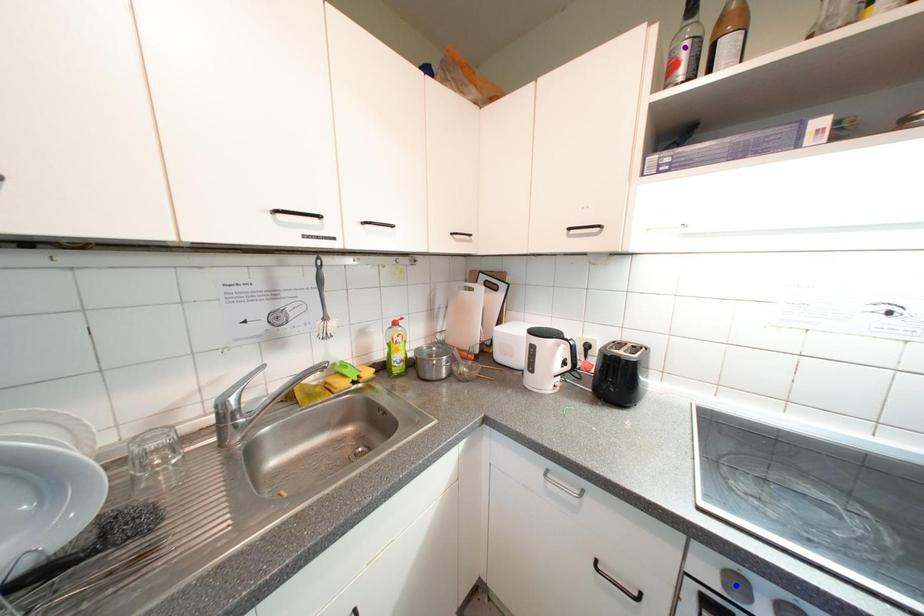
Order these from nearest to farthest:
A) orange point
B) blue point
C) purple point

orange point < purple point < blue point